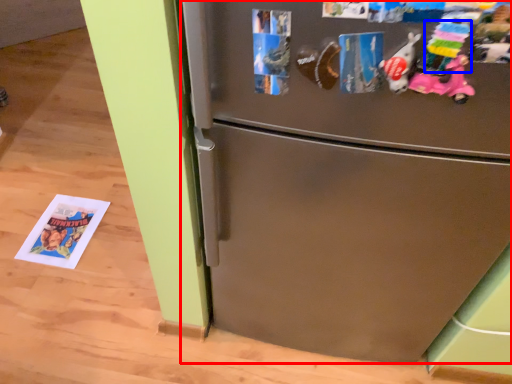
Question: Which object is further to the camera taking this photo, refrigerator (highlighted by a red box) or toy (highlighted by a blue box)?

Choices:
 (A) refrigerator
 (B) toy

Answer: (A)